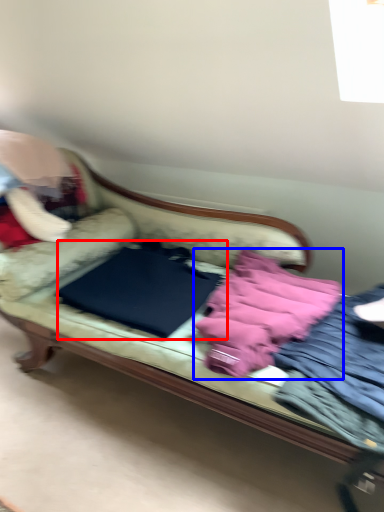
Question: Which of the following is the farthest to the observer, sheet (highlighted by a red box) or material (highlighted by a blue box)?

Choices:
 (A) sheet
 (B) material

Answer: (A)